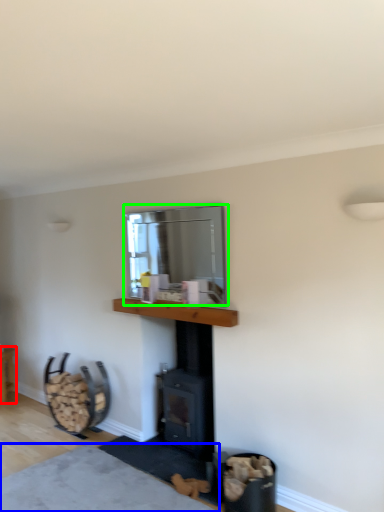
Question: Which is farther away from furniture (highlighted by a red box)? plain (highlighted by a blue box) or window screen (highlighted by a green box)?

Choices:
 (A) plain
 (B) window screen

Answer: (B)